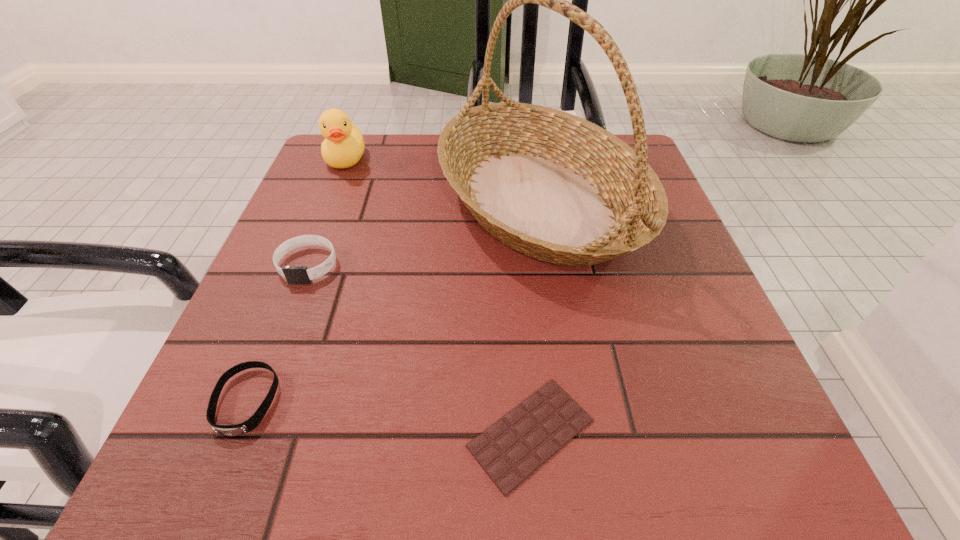
What are the coordinates of `basket located at the far edge` in the screenshot? It's located at (553, 186).

The image size is (960, 540). What are the coordinates of `duck that is positioned at the far edge` in the screenshot? It's located at (x=343, y=146).

Image resolution: width=960 pixels, height=540 pixels. Find the location of `wristband that is positioned at the near edge`. wristband that is positioned at the near edge is located at coordinates (227, 430).

You are a GUI agent. You are given a task and a screenshot of the screen. Output one action in this format:
    pyautogui.click(x=<x>, y=<y>)
    Task: Click on the chocolate bar present at the near edge
    The image size is (960, 540).
    Given the screenshot: What is the action you would take?
    pyautogui.click(x=510, y=450)

The image size is (960, 540). I want to click on duck that is at the left edge, so click(x=343, y=146).

Locate an element on the screen. object situated at the right edge is located at coordinates (553, 186).

Where is `object at the far left corner`? This screenshot has height=540, width=960. object at the far left corner is located at coordinates (343, 146).

Locate an element on the screen. The width and height of the screenshot is (960, 540). object at the near left corner is located at coordinates (227, 430).

Find the location of a particular element. object located at the far right corner is located at coordinates (553, 186).

The height and width of the screenshot is (540, 960). In the image, there is a desktop. Find the location of `vacant space at the far edge`. vacant space at the far edge is located at coordinates (420, 157).